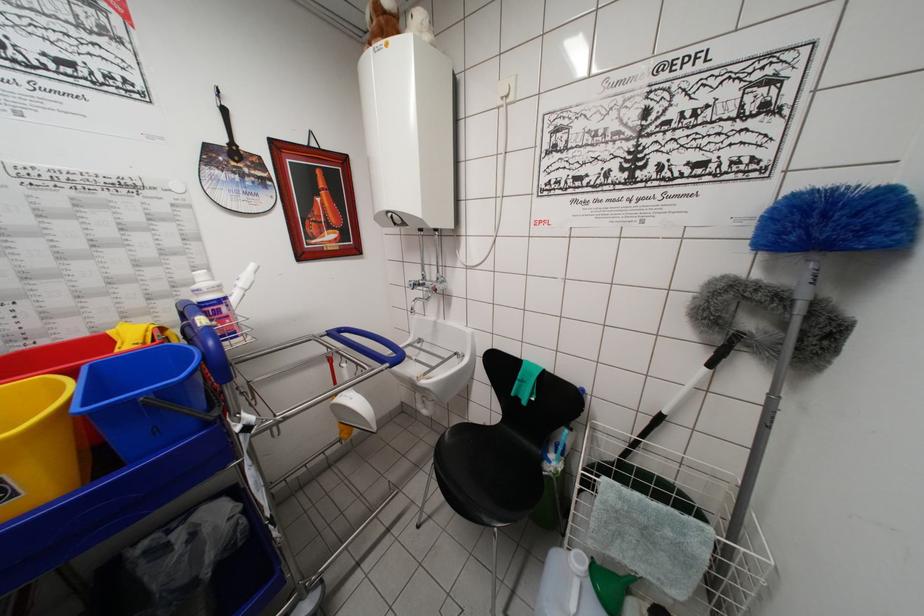
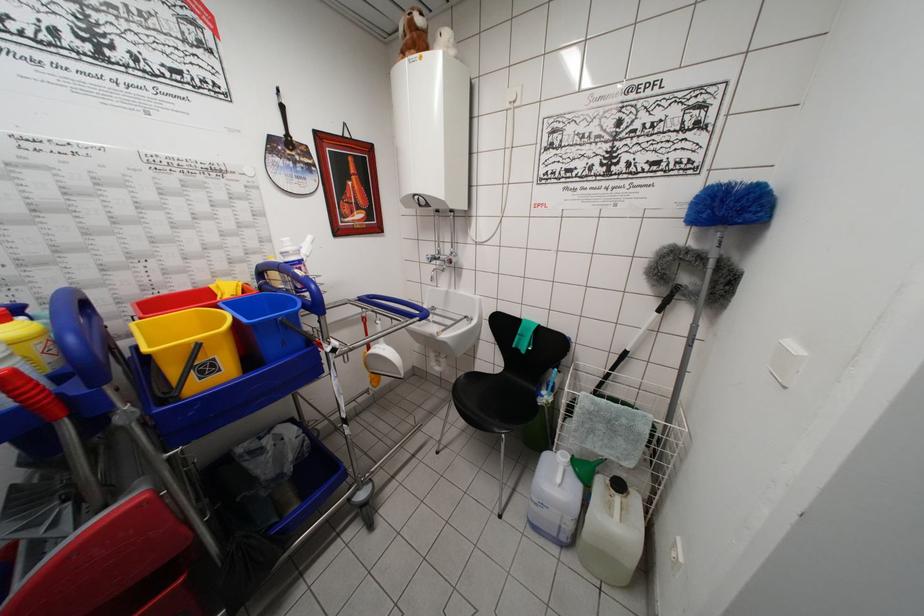
Locate, in the second image, the point that corresponds to point (330, 336) in the first image.

(360, 302)